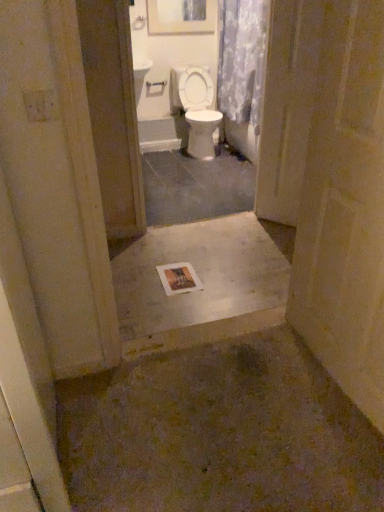
Question: Considering the relative positions of floral fabric shower curtain at upper center and wooden framed artwork at upper center in the image provided, is floral fabric shower curtain at upper center to the left of wooden framed artwork at upper center from the viewer's perspective?

Choices:
 (A) no
 (B) yes

Answer: (A)

Question: Is floral fabric shower curtain at upper center wider than wooden framed artwork at upper center?

Choices:
 (A) yes
 (B) no

Answer: (A)

Question: Is floral fabric shower curtain at upper center behind wooden framed artwork at upper center?

Choices:
 (A) no
 (B) yes

Answer: (A)

Question: From a real-world perspective, is floral fabric shower curtain at upper center below wooden framed artwork at upper center?

Choices:
 (A) no
 (B) yes

Answer: (B)

Question: Is floral fabric shower curtain at upper center positioned far away from wooden framed artwork at upper center?

Choices:
 (A) yes
 (B) no

Answer: (B)

Question: Relative to smooth beige door at lower right, is clear plastic screen door at center in front or behind?

Choices:
 (A) behind
 (B) front

Answer: (A)

Question: Is point (294, 206) closer or farther from the camera than point (352, 130)?

Choices:
 (A) farther
 (B) closer

Answer: (A)

Question: From the image's perspective, is clear plastic screen door at center above or below smooth beige door at lower right?

Choices:
 (A) below
 (B) above

Answer: (B)

Question: Is clear plastic screen door at center taller or shorter than smooth beige door at lower right?

Choices:
 (A) short
 (B) tall

Answer: (B)

Question: In terms of height, does wooden framed artwork at upper center look taller or shorter compared to smooth concrete slab at center?

Choices:
 (A) tall
 (B) short

Answer: (A)

Question: Considering the positions of wooden framed artwork at upper center and smooth concrete slab at center in the image, is wooden framed artwork at upper center wider or thinner than smooth concrete slab at center?

Choices:
 (A) wide
 (B) thin

Answer: (B)

Question: Relative to smooth concrete slab at center, is wooden framed artwork at upper center in front or behind?

Choices:
 (A) behind
 (B) front

Answer: (A)

Question: Considering the positions of point (170, 23) and point (230, 222), is point (170, 23) closer or farther from the camera than point (230, 222)?

Choices:
 (A) farther
 (B) closer

Answer: (A)

Question: Is smooth beige door at lower right situated inside floral fabric shower curtain at upper center or outside?

Choices:
 (A) outside
 (B) inside

Answer: (A)

Question: From the image's perspective, relative to floral fabric shower curtain at upper center, is smooth beige door at lower right above or below?

Choices:
 (A) below
 (B) above

Answer: (A)